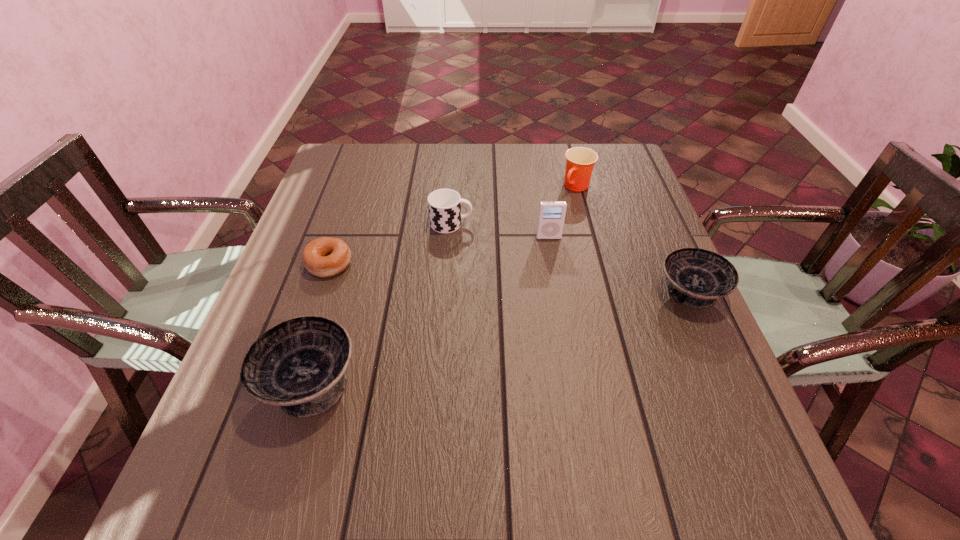
You are a GUI agent. You are given a task and a screenshot of the screen. Output one action in this format:
    pyautogui.click(x=<x>, y=<y>)
    Task: Click on the object that stands as the fifth closest to the left cup
    
    Given the screenshot: What is the action you would take?
    pyautogui.click(x=697, y=277)

The width and height of the screenshot is (960, 540). Identify the location of vacant space that satisfies the following two spatial constraints: 1. on the side of the shorter cup with the handle; 2. on the back side of the shorter bowl. (446, 293).

Identify the location of free space that satisfies the following two spatial constraints: 1. on the side of the second farthest object with the handle; 2. on the front side of the nearer bowl. The image size is (960, 540). (440, 382).

The height and width of the screenshot is (540, 960). Find the location of `blank space that satisfies the following two spatial constraints: 1. on the side of the nearer cup with the handle; 2. on the left side of the right bowl`. blank space that satisfies the following two spatial constraints: 1. on the side of the nearer cup with the handle; 2. on the left side of the right bowl is located at coordinates (446, 293).

This screenshot has height=540, width=960. I want to click on vacant space that satisfies the following two spatial constraints: 1. on the front side of the second object from right to left; 2. on the side of the second farthest object with the handle, so click(587, 224).

Where is `vacant space that satisfies the following two spatial constraints: 1. on the front-facing side of the farther bowl; 2. on the left side of the fourth object from left to right`? The width and height of the screenshot is (960, 540). vacant space that satisfies the following two spatial constraints: 1. on the front-facing side of the farther bowl; 2. on the left side of the fourth object from left to right is located at coordinates (558, 293).

Find the location of a particular element. This screenshot has height=540, width=960. free space that satisfies the following two spatial constraints: 1. on the back side of the shortest object; 2. on the right side of the farthest object is located at coordinates (356, 187).